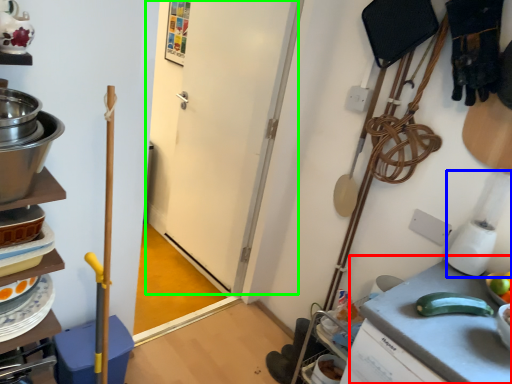
Question: Estimate the real-world distances between objects in this image. Which object is closer to counter top (highlighted by a red box), blender (highlighted by a blue box) or door (highlighted by a green box)?

Choices:
 (A) blender
 (B) door

Answer: (A)